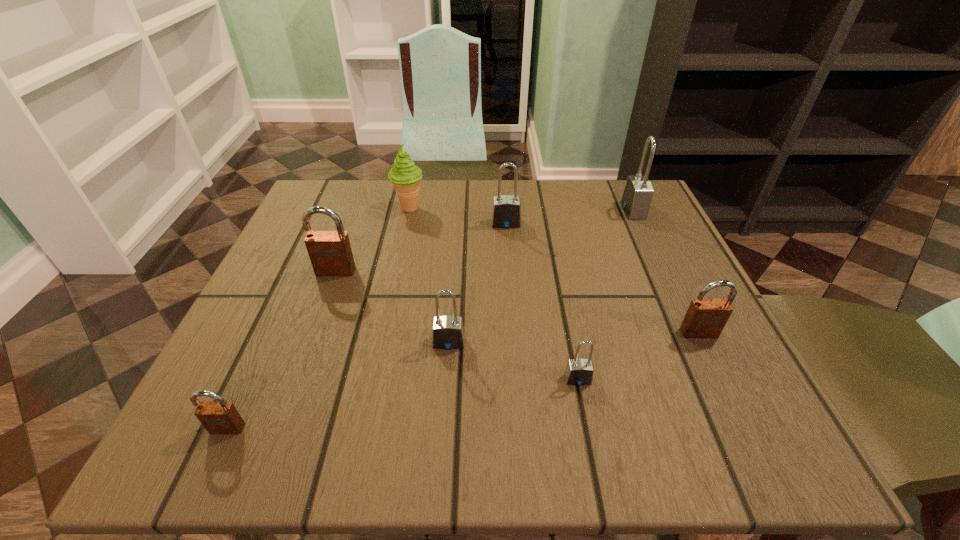
Locate which gray padlock is the third closest to the fifth padlock from right to left. Please provide its 2D coordinates. Your answer should be formatted as a tuple, i.e. [(x, y)], where the tuple contains the x and y coordinates of a point satisfying the conditions above.

[(638, 192)]

Select which brown padlock appears as the second closest to the nearest brown padlock. Please provide its 2D coordinates. Your answer should be formatted as a tuple, i.e. [(x, y)], where the tuple contains the x and y coordinates of a point satisfying the conditions above.

[(705, 318)]

Locate which brown padlock is the third closest to the sixth object from right to left. Please provide its 2D coordinates. Your answer should be formatted as a tuple, i.e. [(x, y)], where the tuple contains the x and y coordinates of a point satisfying the conditions above.

[(705, 318)]

Where is `vacant point that satisfies the following two spatial constraints: 1. on the shackle of the tallest padlock; 2. on the shackle of the leftmost gray padlock`? This screenshot has height=540, width=960. vacant point that satisfies the following two spatial constraints: 1. on the shackle of the tallest padlock; 2. on the shackle of the leftmost gray padlock is located at coordinates (695, 342).

This screenshot has width=960, height=540. In order to click on vacant space that satisfies the following two spatial constraints: 1. on the shackle of the biggest gray padlock; 2. on the front-facing side of the nearest padlock in this screenshot , I will do `click(735, 428)`.

In order to click on vacant space that satisfies the following two spatial constraints: 1. on the shackle of the biggest gray padlock; 2. on the shackle of the second smallest gray padlock in this screenshot , I will do `click(695, 342)`.